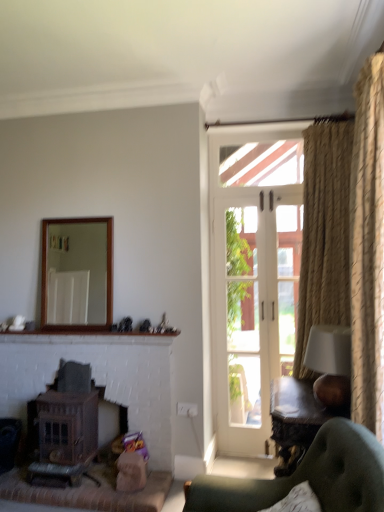
You are a GUI agent. You are given a task and a screenshot of the screen. Output one action in this format:
    pyautogui.click(x=<x>, y=<y>)
    Task: Click on the free space above wooden frame mirror at upper center (from a real-world perspective)
    This screenshot has height=512, width=384.
    Given the screenshot: What is the action you would take?
    pyautogui.click(x=85, y=212)